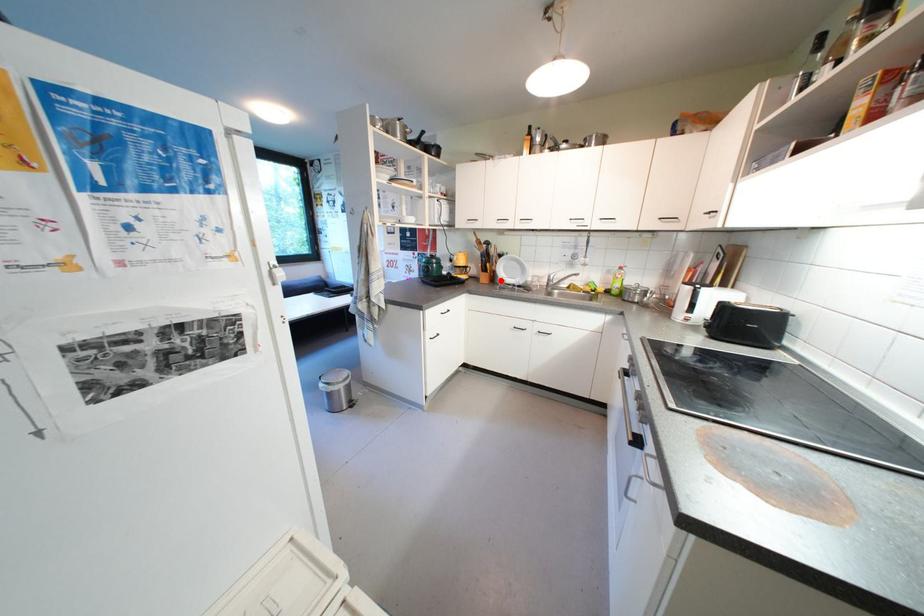
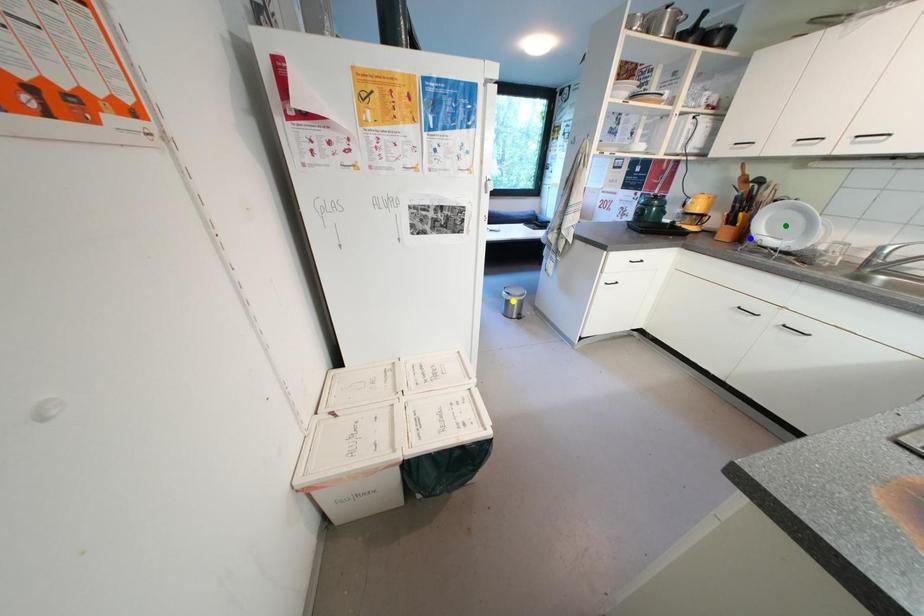
Question: I am providing you with two images of the same scene from different viewpoints. A red point is marked on the first image. You are given multiple points on the second image. Can you choose the point in image 2 that corresponds to the point in image 1?

Choices:
 (A) green point
 (B) blue point
 (C) yellow point

Answer: (B)